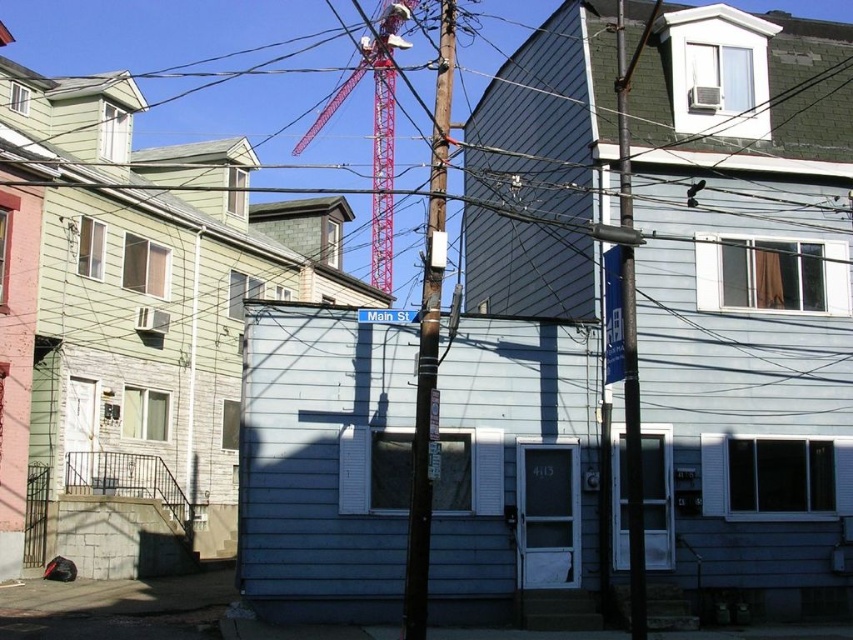
Which is more to the right, smooth wood telegraph pole at center or red metal crane at upper center?

From the viewer's perspective, smooth wood telegraph pole at center appears more on the right side.

Does smooth wood telegraph pole at center have a lesser height compared to red metal crane at upper center?

Yes.

At what (x,y) coordinates should I click in order to perform the action: click on smooth wood telegraph pole at center. Please return your answer as a coordinate pair (x, y). Looking at the image, I should click on (633, 451).

Where is `smooth wood telegraph pole at center`? smooth wood telegraph pole at center is located at coordinates (633, 451).

Does brown wooden telegraph pole at center have a lesser height compared to smooth wood telegraph pole at center?

Yes, brown wooden telegraph pole at center is shorter than smooth wood telegraph pole at center.

Measure the distance between brown wooden telegraph pole at center and camera.

A distance of 49.69 feet exists between brown wooden telegraph pole at center and camera.

Between point (432, 284) and point (640, 234), which one is positioned behind?

Point (640, 234)

Locate an element on the screen. brown wooden telegraph pole at center is located at coordinates (428, 340).

Is brown wooden telegraph pole at center wider than red metal crane at upper center?

No.

From the picture: Who is more forward, (428, 260) or (383, 196)?

Point (428, 260) is more forward.

Image resolution: width=853 pixels, height=640 pixels. What do you see at coordinates (428, 340) in the screenshot?
I see `brown wooden telegraph pole at center` at bounding box center [428, 340].

Where is `brown wooden telegraph pole at center`? The width and height of the screenshot is (853, 640). brown wooden telegraph pole at center is located at coordinates (428, 340).